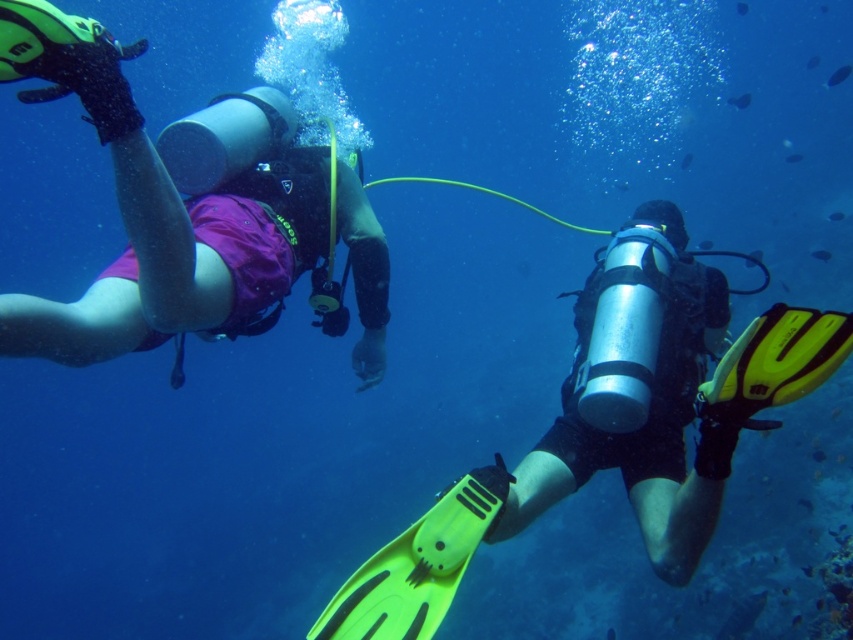
You are a marine biologist observing the underwater scene. You need to determine the relative positions of the matte purple shorts at left and the matte silver cylinder at center. Which object is closer to you from your observation point?

The matte purple shorts at left is closer to you because it is positioned in front of the matte silver cylinder at center.

You are a scuba diver and want to reach the point at coordinates point (85, 307). Your current depth is 2 meters. Can you safely reach that point without exceeding a maximum depth of 4 meters?

The distance of point (85, 307) from the camera is 2.23 meters. Since your current depth is 2 meters and the maximum allowed depth is 4 meters, you can safely reach the point as the total depth would be within limits.